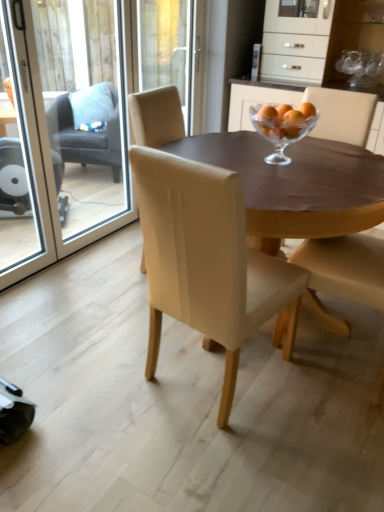
Identify the location of free location in front of clear glass bowl at center. (299, 176).